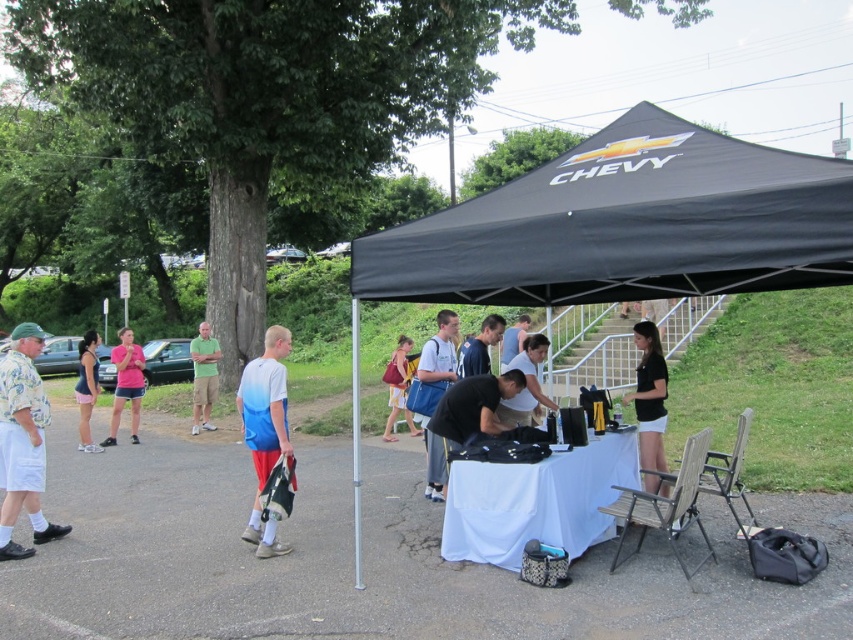
You are standing at the edge of the CHEVY tent and need to hand out promotional materials to both the person wearing the paisley fabric shirt at left and the person in the matte black shirt at center. If you can only carry materials for one person at a time, which direction should you walk first to reach the closest individual?

The paisley fabric shirt at left is 12.38 feet away from the matte black shirt at center. Since you are at the edge of the CHEVY tent, the closest individual would depend on your starting position. However, without specific distance from the tent to each shirt, we cannot determine which is closer. Please clarify your starting point.

You are attending a Chevy promotional event and notice two items of interest under the canopy tent. The first is a paisley fabric shirt at left, and the second is a yellow fabric purse at center. From your vantage point, which item is closer to you?

The paisley fabric shirt at left is closer to you because it is in front of the yellow fabric purse at center.